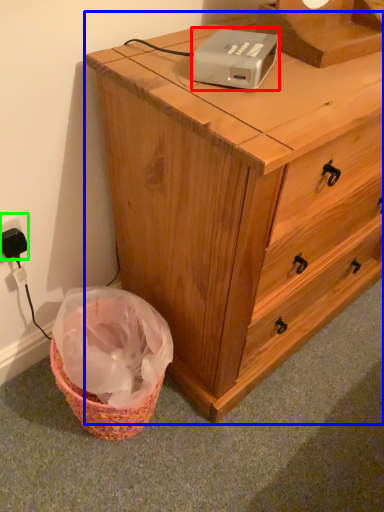
Question: Estimate the real-world distances between objects in this image. Which object is farther from gadget (highlighted by a red box), chest of drawers (highlighted by a blue box) or electric outlet (highlighted by a green box)?

Choices:
 (A) chest of drawers
 (B) electric outlet

Answer: (B)